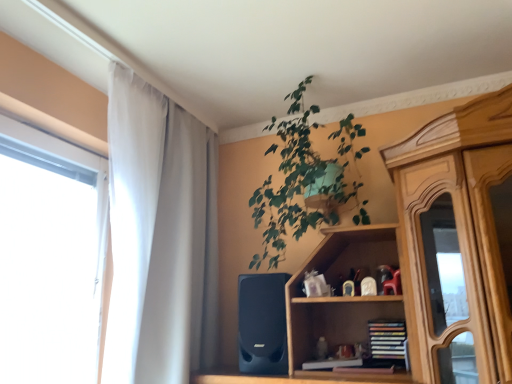
Question: Considering the positions of point (246, 360) and point (161, 286), is point (246, 360) closer or farther from the camera than point (161, 286)?

Choices:
 (A) farther
 (B) closer

Answer: (B)

Question: From a real-world perspective, is black matte speaker at lower center above or below white sheer curtain at left?

Choices:
 (A) above
 (B) below

Answer: (B)

Question: Which is farther from the white sheer curtain at left?

Choices:
 (A) green leafy plant at upper center
 (B) black matte speaker at lower center
 (C) hardcover books at center

Answer: (C)

Question: Estimate the real-world distances between objects in this image. Which object is closer to the hardcover books at center?

Choices:
 (A) black matte speaker at lower center
 (B) green leafy plant at upper center
 (C) white sheer curtain at left

Answer: (A)